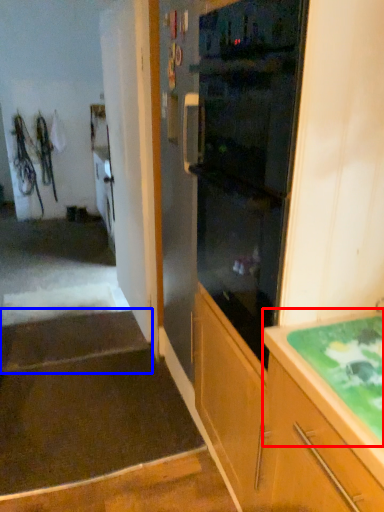
Question: Which point is further to the camera, countertop (highlighted by a red box) or stairwell (highlighted by a blue box)?

Choices:
 (A) countertop
 (B) stairwell

Answer: (B)